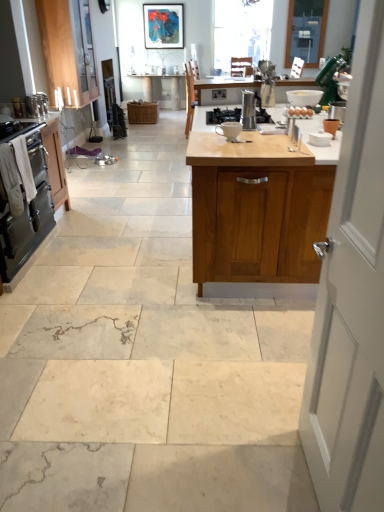
Question: Is black matte gas stove at center in front of white towel oven at left, the 2th cabinetry when ordered from left to right?

Choices:
 (A) yes
 (B) no

Answer: (A)

Question: Could you tell me if black matte gas stove at center is facing white towel oven at left, which is counted as the second cabinetry, starting from the right?

Choices:
 (A) no
 (B) yes

Answer: (A)

Question: Is black matte gas stove at center directly adjacent to white towel oven at left, which is counted as the second cabinetry, starting from the right?

Choices:
 (A) no
 (B) yes

Answer: (A)

Question: Is black matte gas stove at center oriented away from white towel oven at left, which is counted as the second cabinetry, starting from the right?

Choices:
 (A) yes
 (B) no

Answer: (B)

Question: Considering the relative sizes of black matte gas stove at center and white towel oven at left, the 2th cabinetry when ordered from left to right, in the image provided, is black matte gas stove at center shorter than white towel oven at left, the 2th cabinetry when ordered from left to right,?

Choices:
 (A) no
 (B) yes

Answer: (B)

Question: Is point (296, 116) positioned closer to the camera than point (6, 233)?

Choices:
 (A) farther
 (B) closer

Answer: (A)

Question: In terms of height, does brown matte eggs at center look taller or shorter compared to black enamel oven at left?

Choices:
 (A) short
 (B) tall

Answer: (A)

Question: Is brown matte eggs at center in front of or behind black enamel oven at left in the image?

Choices:
 (A) behind
 (B) front

Answer: (A)

Question: From a real-world perspective, relative to black enamel oven at left, is brown matte eggs at center vertically above or below?

Choices:
 (A) below
 (B) above

Answer: (B)

Question: From a real-world perspective, is terracotta clay pot at upper right, the fourth appliance positioned from the back, positioned above or below metallic silver coffee maker at center, which is the third appliance in back-to-front order?

Choices:
 (A) below
 (B) above

Answer: (A)

Question: Is terracotta clay pot at upper right, which is the fifth appliance from left to right, taller or shorter than metallic silver coffee maker at center, the fourth appliance viewed from the left?

Choices:
 (A) tall
 (B) short

Answer: (B)

Question: Is terracotta clay pot at upper right, which is counted as the 1th appliance, starting from the right, to the left or to the right of metallic silver coffee maker at center, which appears as the 3th appliance when viewed from the front, in the image?

Choices:
 (A) right
 (B) left

Answer: (A)

Question: In the image, is terracotta clay pot at upper right, the fourth appliance positioned from the back, positioned in front of or behind metallic silver coffee maker at center, the fourth appliance viewed from the left?

Choices:
 (A) behind
 (B) front

Answer: (B)

Question: Does point (48, 13) appear closer or farther from the camera than point (150, 29)?

Choices:
 (A) farther
 (B) closer

Answer: (B)

Question: In terms of width, does wooden cabinet at upper left, the 3th cabinetry when ordered from right to left, look wider or thinner when compared to matte black picture frame at upper center?

Choices:
 (A) thin
 (B) wide

Answer: (B)